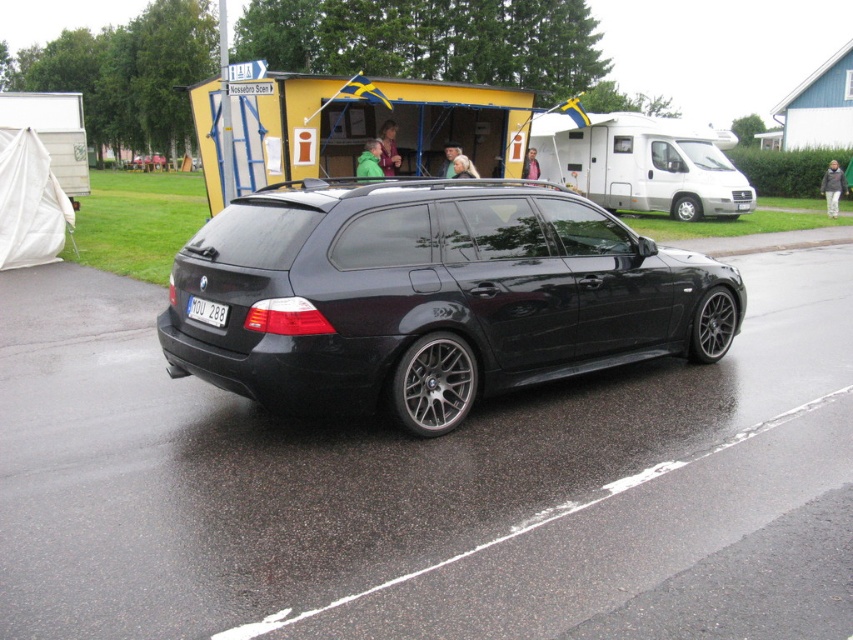
Question: Which point is farther from the camera taking this photo?

Choices:
 (A) (831, 163)
 (B) (253, 112)
 (C) (206, 307)

Answer: (A)

Question: Is white plastic license plate at rear positioned at the back of green fabric jacket at center?

Choices:
 (A) yes
 (B) no

Answer: (B)

Question: Based on their relative distances, which object is nearer to the green matte jacket at center?

Choices:
 (A) white plastic license plate at rear
 (B) green fabric jacket at center

Answer: (B)

Question: Which object is closer to the camera taking this photo?

Choices:
 (A) black fabric jacket at lower right
 (B) green fabric jacket at center
 (C) green matte jacket at center
 (D) white plastic license plate at rear

Answer: (D)

Question: Is green fabric jacket at center above leather jacket at center?

Choices:
 (A) no
 (B) yes

Answer: (A)

Question: Does green fabric jacket at center appear on the right side of leather jacket at center?

Choices:
 (A) no
 (B) yes

Answer: (A)